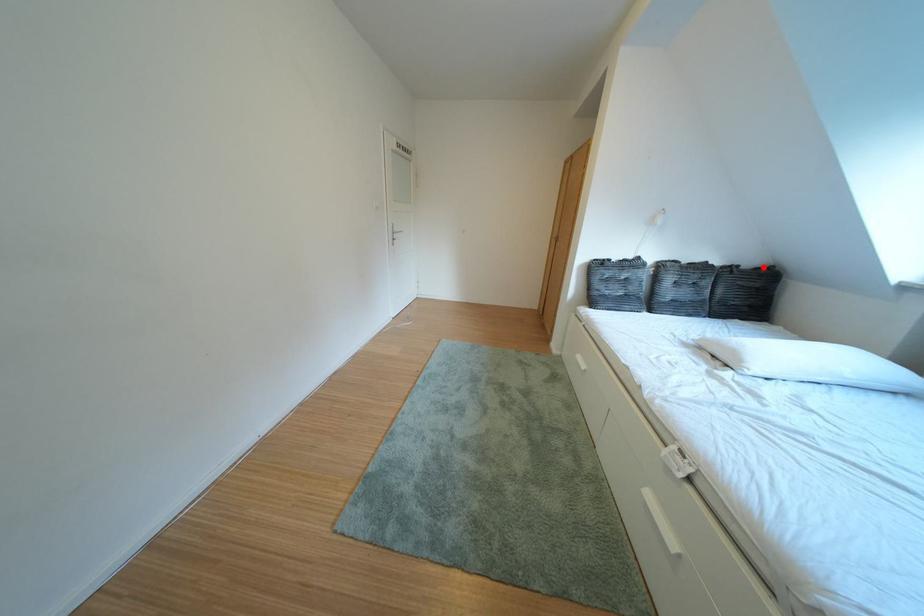
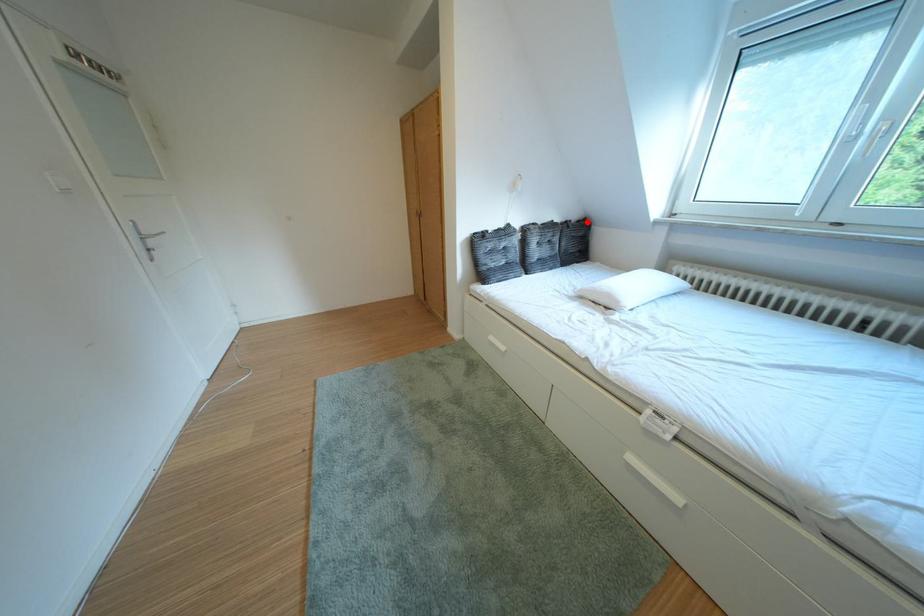
I am providing you with two images of the same scene from different viewpoints. A red point is marked on the first image and another point is marked on the second image. Does the point marked in image1 correspond to the same location as the one in image2?

Yes